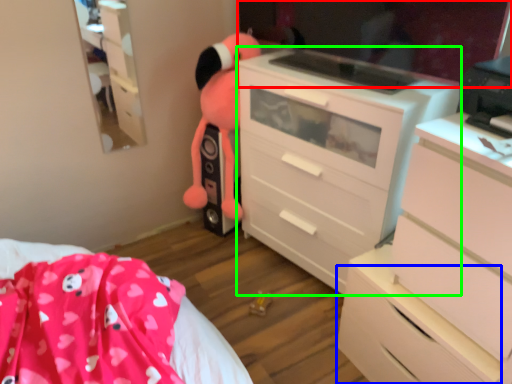
Question: Estimate the real-world distances between objects in this image. Which object is closer to mirror (highlighted by a red box), drawer (highlighted by a blue box) or chest of drawers (highlighted by a green box)?

Choices:
 (A) drawer
 (B) chest of drawers

Answer: (B)